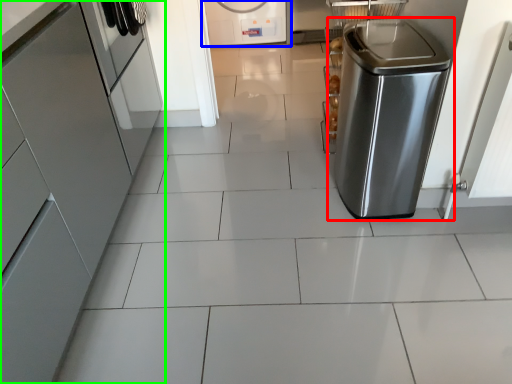
Question: Considering the real-world distances, which object is farthest from home appliance (highlighted by a red box)? home appliance (highlighted by a blue box) or home appliance (highlighted by a green box)?

Choices:
 (A) home appliance
 (B) home appliance

Answer: (A)